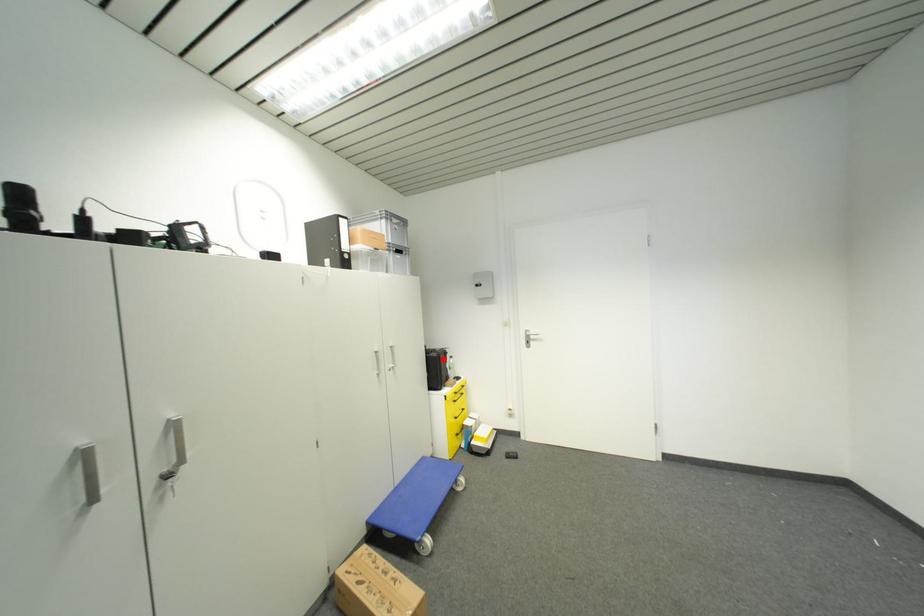
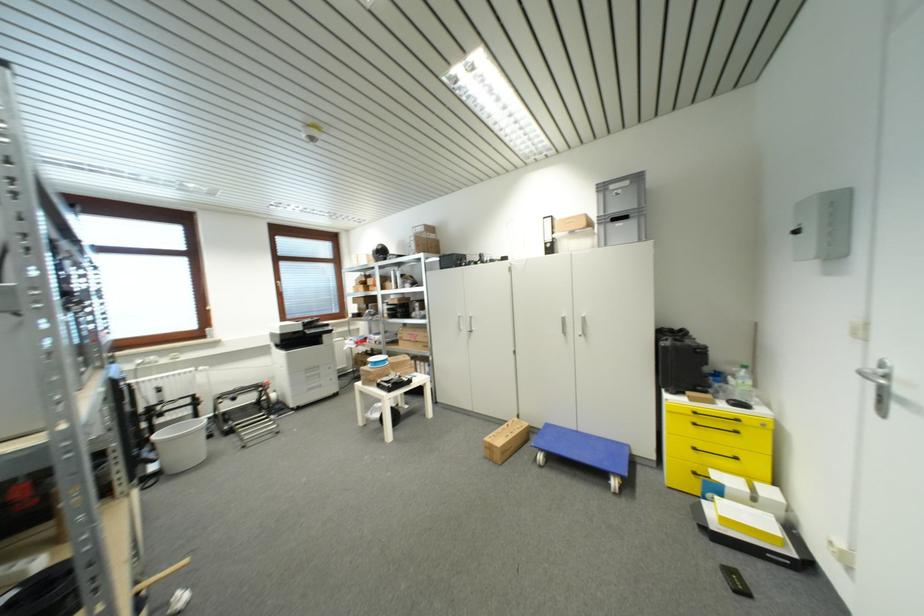
Locate, in the second image, the point that corresponds to the highlighted location in the first image.

(670, 351)